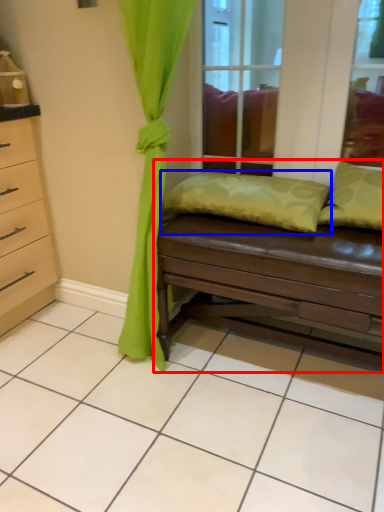
Question: Which object is further to the camera taking this photo, studio couch (highlighted by a red box) or pillow (highlighted by a blue box)?

Choices:
 (A) studio couch
 (B) pillow

Answer: (B)